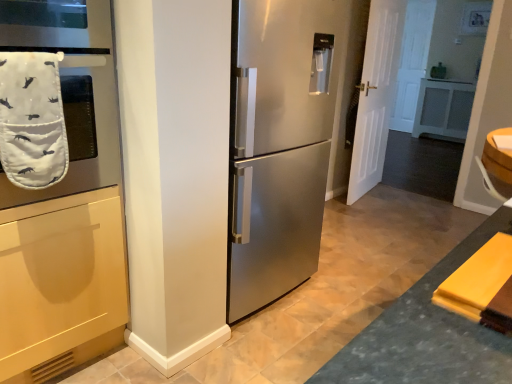
Question: Should I look upward or downward to see white matte door at right?

Choices:
 (A) down
 (B) up

Answer: (B)

Question: Is white matte door at right surrounding white fabric oven mitt at left?

Choices:
 (A) yes
 (B) no

Answer: (B)

Question: Is white matte door at right to the right of white fabric oven mitt at left from the viewer's perspective?

Choices:
 (A) yes
 (B) no

Answer: (A)

Question: Considering the relative sizes of white matte door at right and white fabric oven mitt at left in the image provided, is white matte door at right bigger than white fabric oven mitt at left?

Choices:
 (A) no
 (B) yes

Answer: (A)

Question: Does white matte door at right have a greater height compared to white fabric oven mitt at left?

Choices:
 (A) yes
 (B) no

Answer: (A)

Question: From a real-world perspective, is white matte door at right below white fabric oven mitt at left?

Choices:
 (A) yes
 (B) no

Answer: (A)

Question: From the image's perspective, is white matte door at right above white fabric oven mitt at left?

Choices:
 (A) yes
 (B) no

Answer: (A)

Question: From a real-world perspective, is stainless steel refrigerator at center beneath white fabric oven mitt at left?

Choices:
 (A) no
 (B) yes

Answer: (B)

Question: Is stainless steel refrigerator at center not within white fabric oven mitt at left?

Choices:
 (A) yes
 (B) no

Answer: (A)

Question: From a real-world perspective, is stainless steel refrigerator at center on white fabric oven mitt at left?

Choices:
 (A) no
 (B) yes

Answer: (A)

Question: Is stainless steel refrigerator at center at the left side of white fabric oven mitt at left?

Choices:
 (A) no
 (B) yes

Answer: (A)

Question: Is stainless steel refrigerator at center wider than white fabric oven mitt at left?

Choices:
 (A) yes
 (B) no

Answer: (A)

Question: Is stainless steel refrigerator at center further to the viewer compared to white fabric oven mitt at left?

Choices:
 (A) yes
 (B) no

Answer: (A)

Question: Are white quilted oven mitt at left and stainless steel refrigerator at center making contact?

Choices:
 (A) no
 (B) yes

Answer: (A)